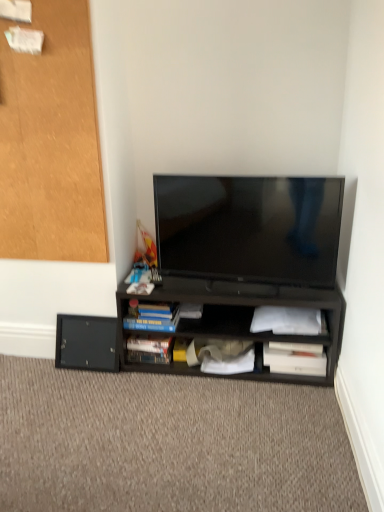
Locate an element on the screen. The height and width of the screenshot is (512, 384). empty space that is ontop of carpet at lower center (from a real-world perspective) is located at coordinates (142, 416).